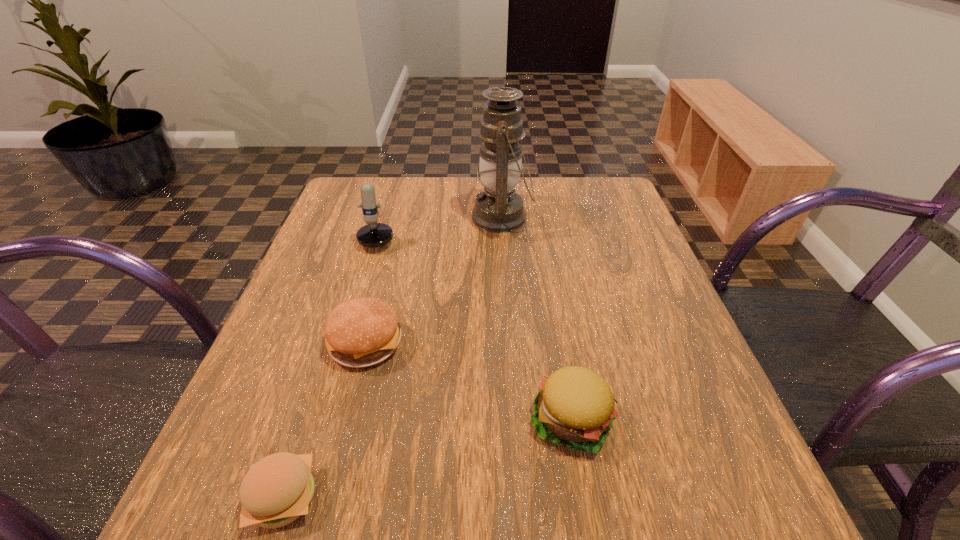
Locate an element on the screen. free region at the far left corner of the desktop is located at coordinates (379, 202).

Where is `blank region between the second nearest hamburger and the nearest object`? This screenshot has height=540, width=960. blank region between the second nearest hamburger and the nearest object is located at coordinates (427, 459).

Identify the location of unoccupied position between the nearest hamburger and the rightmost hamburger. (427, 459).

I want to click on free spot between the rightmost hamburger and the microphone, so click(x=475, y=325).

Where is `free space between the nearest hamburger and the oil lamp`? Image resolution: width=960 pixels, height=540 pixels. free space between the nearest hamburger and the oil lamp is located at coordinates (393, 357).

The height and width of the screenshot is (540, 960). Find the location of `vacant point located between the second tallest object and the oil lamp`. vacant point located between the second tallest object and the oil lamp is located at coordinates (442, 224).

Locate an element on the screen. empty space between the nearest object and the third farthest object is located at coordinates (325, 420).

Locate an element on the screen. This screenshot has height=540, width=960. vacant space that's between the nearest object and the third nearest object is located at coordinates (325, 420).

Identify the location of free space between the second farthest hamburger and the fourth shortest object. (475, 325).

Identify the location of vacant space that's between the oil lamp and the fourth shortest object. (442, 224).